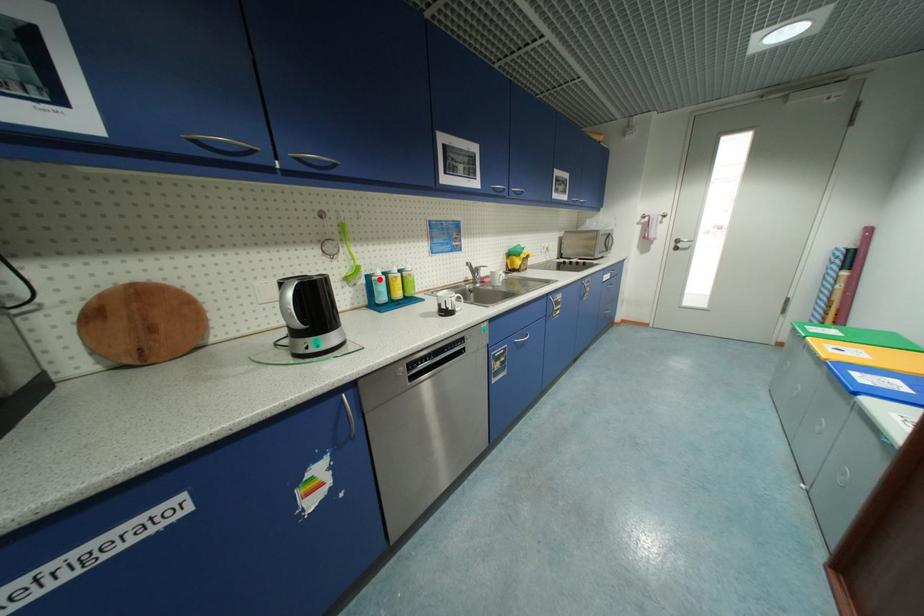
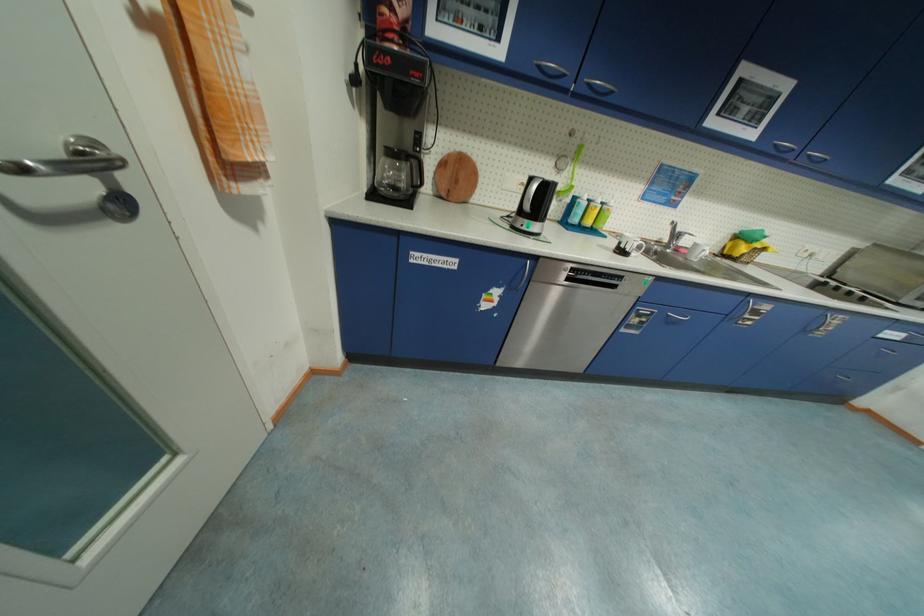
Question: I am providing you with two images of the same scene from different viewpoints. In image1, a red point is highlighted. Considering the same 3D point in image2, which of the following is correct?

Choices:
 (A) It is closer
 (B) It is farther

Answer: (A)